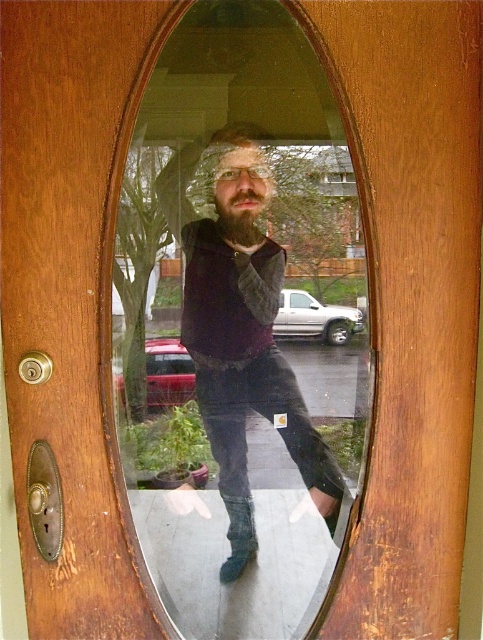
Question: Does clear glass mirror at center appear under matte black sweater at center?

Choices:
 (A) no
 (B) yes

Answer: (A)

Question: Does clear glass mirror at center appear on the right side of matte black sweater at center?

Choices:
 (A) yes
 (B) no

Answer: (B)

Question: Which point is closer to the camera?

Choices:
 (A) clear glass mirror at center
 (B) matte black sweater at center

Answer: (A)

Question: Can you confirm if clear glass mirror at center is positioned to the left of matte black sweater at center?

Choices:
 (A) yes
 (B) no

Answer: (A)